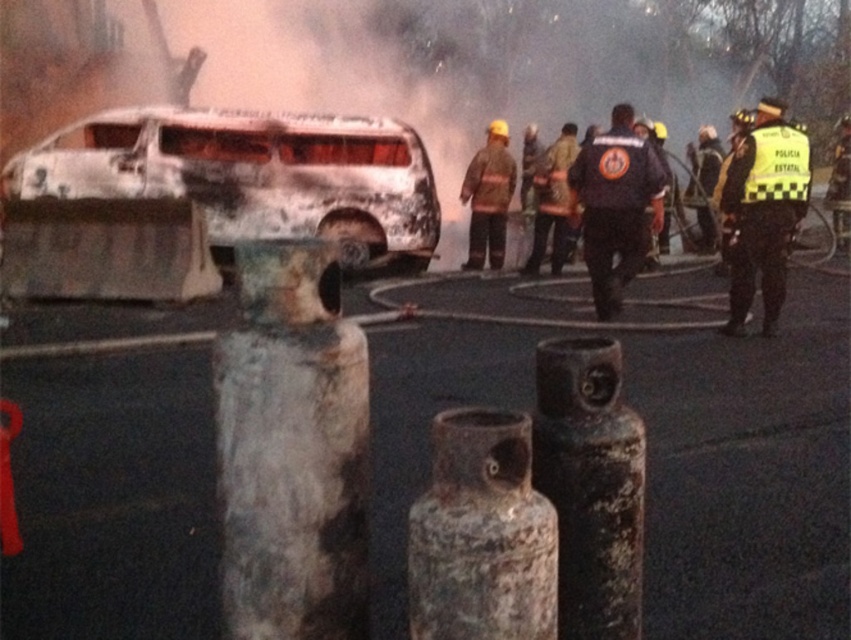
What do you see at coordinates (250, 176) in the screenshot? I see `burnt metallic van at center` at bounding box center [250, 176].

You are a GUI agent. You are given a task and a screenshot of the screen. Output one action in this format:
    pyautogui.click(x=<x>, y=<y>)
    Task: Click on the burnt metallic van at center
    The image size is (851, 640).
    Given the screenshot: What is the action you would take?
    pyautogui.click(x=250, y=176)

You are a GUI agent. You are given a task and a screenshot of the screen. Output one action in this format:
    pyautogui.click(x=<x>, y=<y>)
    Task: Click on the burnt metallic van at center
    Image resolution: width=851 pixels, height=640 pixels.
    Given the screenshot: What is the action you would take?
    pyautogui.click(x=250, y=176)

Describe the element at coordinates (615, 205) in the screenshot. The height and width of the screenshot is (640, 851). I see `black uniform at center` at that location.

Does black uniform at center come in front of yellow reflective vest at center-right?

Yes, black uniform at center is closer to the viewer.

Which is behind, point (604, 276) or point (694, 156)?

Point (694, 156)

The image size is (851, 640). I want to click on black uniform at center, so click(x=615, y=205).

Between black uniform at center and yellow reflective vest at center, which one is positioned lower?

Positioned lower is black uniform at center.

What do you see at coordinates (615, 205) in the screenshot? I see `black uniform at center` at bounding box center [615, 205].

Does point (587, 221) come behind point (848, 156)?

No, it is not.

Locate an element on the screen. black uniform at center is located at coordinates (615, 205).